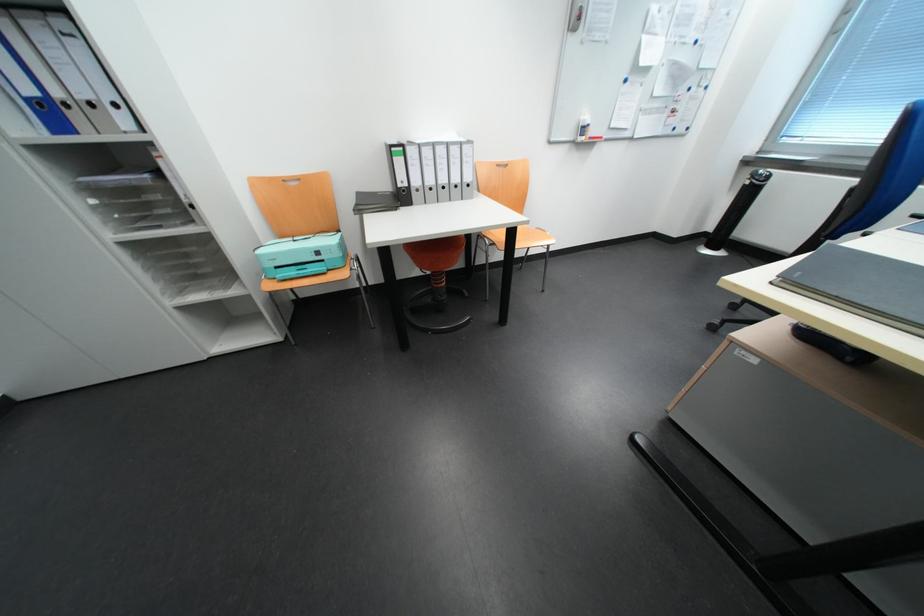
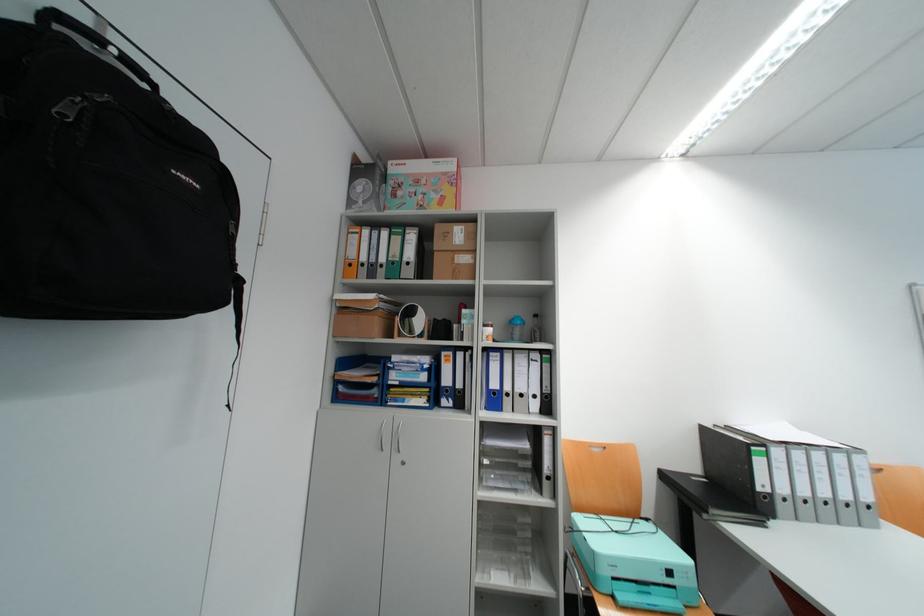
Where in the second image is the point corresponding to (330,254) from the first image?

(682, 573)